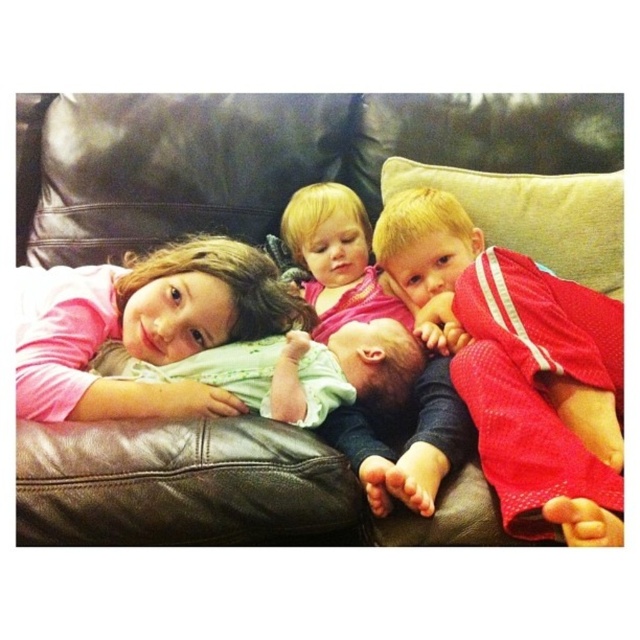
You are a photographer trying to capture a closeup of the soft green fabric baby at center without moving any objects. Since the brown leather couch at center is blocking the view, can you adjust your position to take the photo?

The brown leather couch at center is positioned over soft green fabric baby at center, so you cannot adjust your position to take the photo without moving the couch because it is directly blocking the baby.

Looking at the brown leather couch at center and the red mesh shirt at center in the image, which object is shorter?

The brown leather couch at center is shorter than the red mesh shirt at center.

Based on the photo, you are a photographer standing in front of the couch. You want to focus on the point closer to you between the two points marked as point 1 at (410, 148) and point 2 at (413, 209). Which point should you choose?

You should focus on point 1 at (410, 148) because it is closer to you than point 2 at (413, 209).